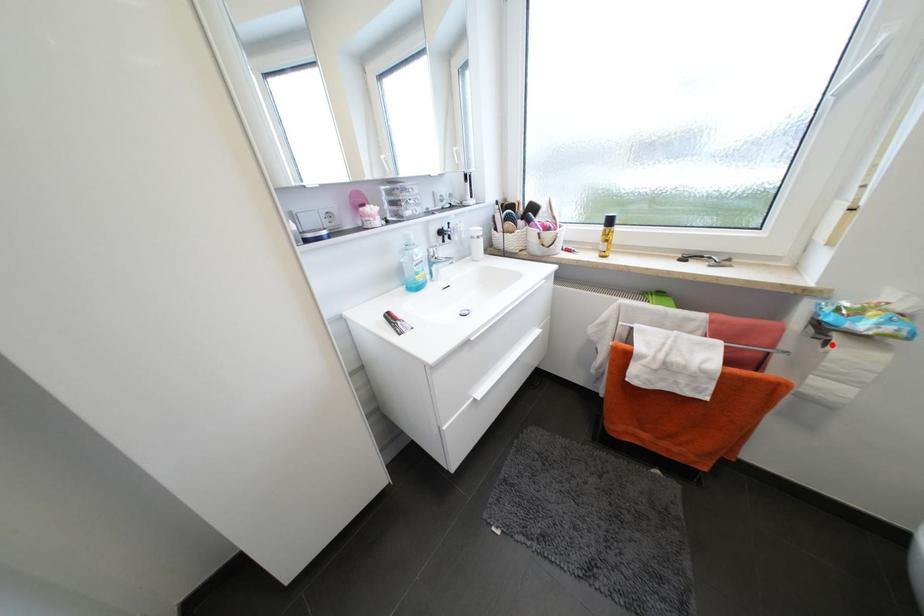
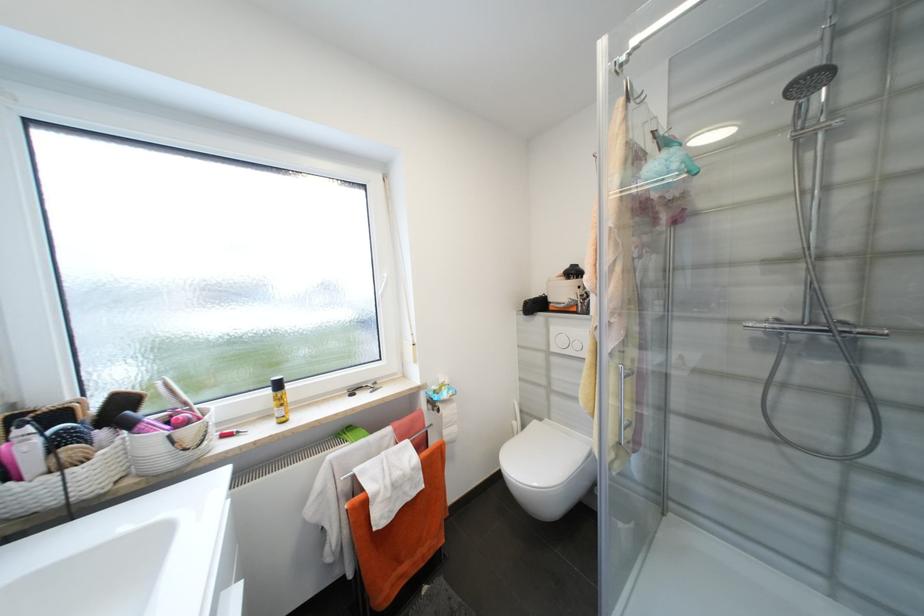
Locate, in the second image, the point that corresponds to the highlighted location in the first image.

(444, 411)